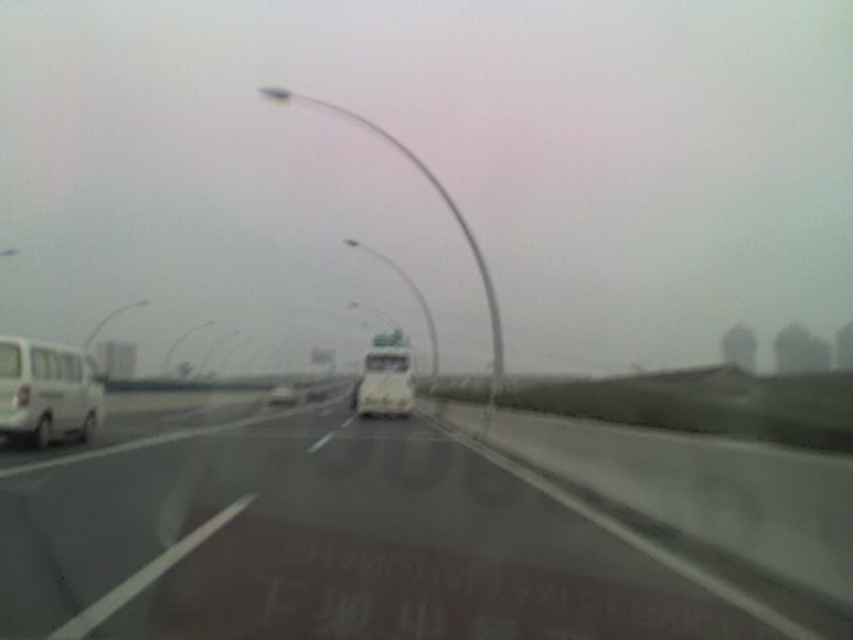
You are driving a car and see the white glossy highway at center and the white matte van at center. Which object is closer to the right side of the road?

The white glossy highway at center is closer to the right side of the road because it is positioned to the right of the white matte van at center.

You are driving a car with a trunk length of 1.5 meters. You need to park your car so that the trunk faces the guardrail. The guardrail is on the right side of the road. Can you park your car so that the trunk is exactly at point (300, 525)?

The distance between the viewer and point (300, 525) is 8.49 meters. Since the trunk is 1.5 meters long, you can park the car so that the trunk reaches the point (300, 525) by positioning the car appropriately within the available space.

You are driving a car and need to stop at a specific point on the road. The point is located at coordinates point (x=314, y=444). If your car requires 60 feet to stop safely, will you be able to stop before reaching that point?

The distance of point (x=314, y=444) from camera is 64.50 feet. Since the stopping distance required is 60 feet, you have enough space to stop before reaching the point (x=314, y=444).